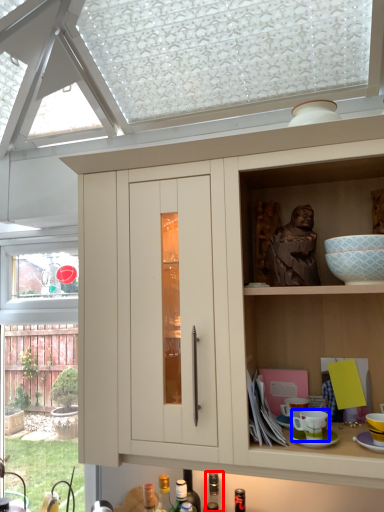
Question: Which object appears farthest to the camera in this image, bottle (highlighted by a red box) or tableware (highlighted by a blue box)?

Choices:
 (A) bottle
 (B) tableware

Answer: (A)